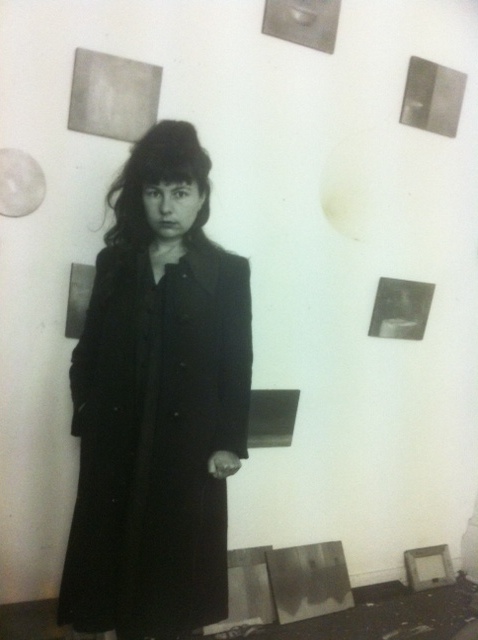
You are a GUI agent. You are given a task and a screenshot of the screen. Output one action in this format:
    pyautogui.click(x=<x>, y=<y>)
    Task: Click on the painting
    
    Given the screenshot: What is the action you would take?
    (x=310, y=595)